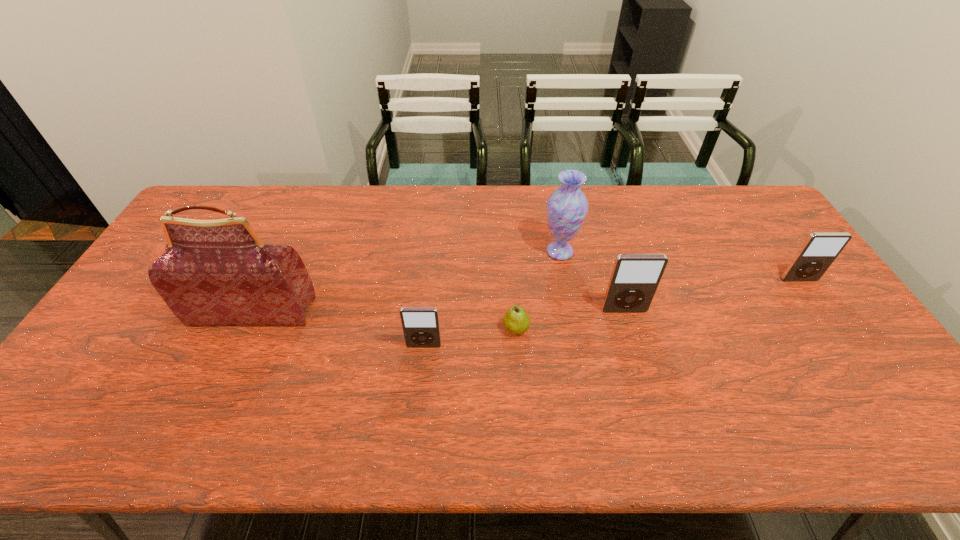
In order to click on the nearest object in this screenshot , I will do `click(421, 328)`.

Identify the location of the shortest iPod. click(421, 328).

Where is `the second farthest iPod`? Image resolution: width=960 pixels, height=540 pixels. the second farthest iPod is located at coordinates (634, 279).

The width and height of the screenshot is (960, 540). Identify the location of the second iPod from right to left. (634, 279).

In order to click on the second tallest iPod in this screenshot , I will do `click(820, 249)`.

Identify the location of the third shortest object. This screenshot has height=540, width=960. click(820, 249).

Where is `handbag`? Image resolution: width=960 pixels, height=540 pixels. handbag is located at coordinates pyautogui.click(x=218, y=272).

Locate an element on the screen. the leftmost object is located at coordinates (218, 272).

This screenshot has width=960, height=540. Find the location of `the third object from right to left`. the third object from right to left is located at coordinates (567, 207).

Locate an element on the screen. The height and width of the screenshot is (540, 960). vase is located at coordinates (567, 207).